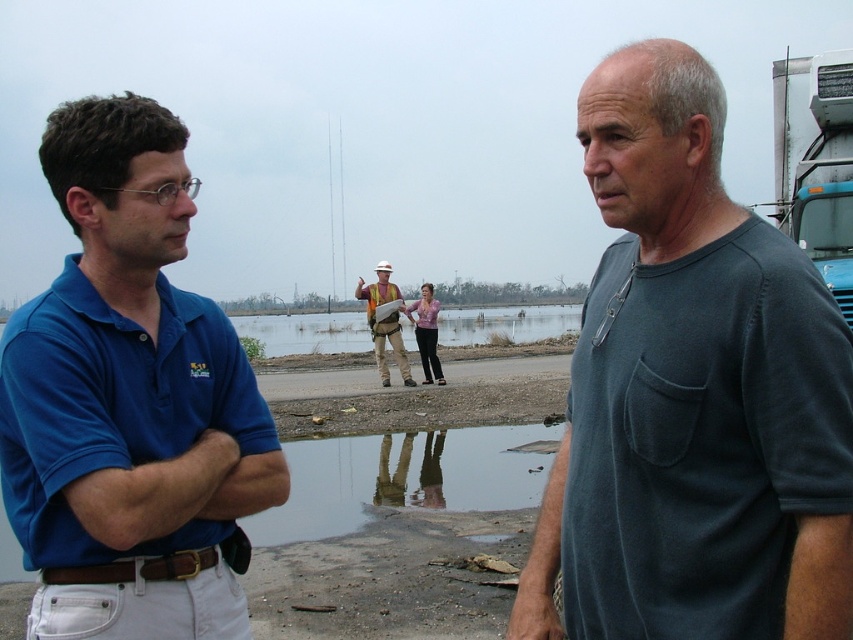
From the picture: You are a disaster response team member assessing the flooded area. You need to cross from the left side of the transparent reflective puddle at center to the right side. Based on the puddle location, which direction should you move relative to the puddle?

The transparent reflective puddle at center is located at point (x=404, y=477), so you should move to the right of the transparent reflective puddle at center to reach the right side.

You are a surveyor standing at the flooded area and need to reach the teal glossy trailer truck at upper right and the brown dirt road at center. Which object is nearer to you?

The teal glossy trailer truck at upper right is closer to the viewer than the brown dirt road at center, so the teal glossy trailer truck at upper right is nearer.